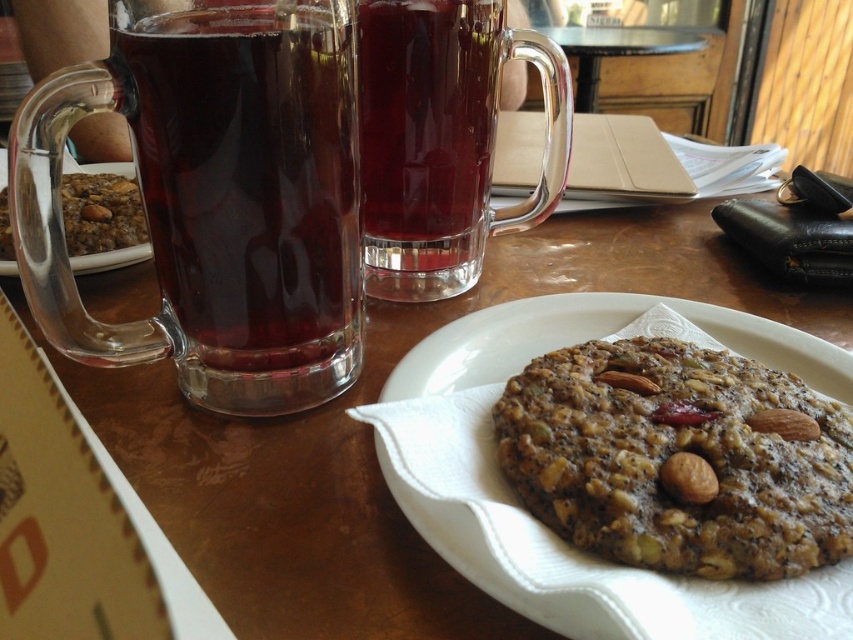
Question: Is dark brown textured cookie at center closer to the viewer compared to brown textured almond at center?

Choices:
 (A) no
 (B) yes

Answer: (B)

Question: Estimate the real-world distances between objects in this image. Which object is farther from the brown textured almond at center?

Choices:
 (A) dark brown textured cookie at center
 (B) crumbly oatmeal cookie at center

Answer: (B)

Question: Does transparent glass mug at upper left appear under dark brown textured cookie at center?

Choices:
 (A) no
 (B) yes

Answer: (A)

Question: Is dark brown textured cookie at center to the right of crumbly oatmeal cookie at center from the viewer's perspective?

Choices:
 (A) no
 (B) yes

Answer: (B)

Question: Which of these objects is positioned farthest from the brown textured almond at center-right?

Choices:
 (A) dark brown textured cookie at center
 (B) brown textured almond at center
 (C) crumbly oatmeal cookie at center

Answer: (C)

Question: Which object is the closest to the transparent glass mug at upper left?

Choices:
 (A) brown textured almond at center-right
 (B) dark brown textured cookie at center
 (C) brown textured almond at center

Answer: (B)